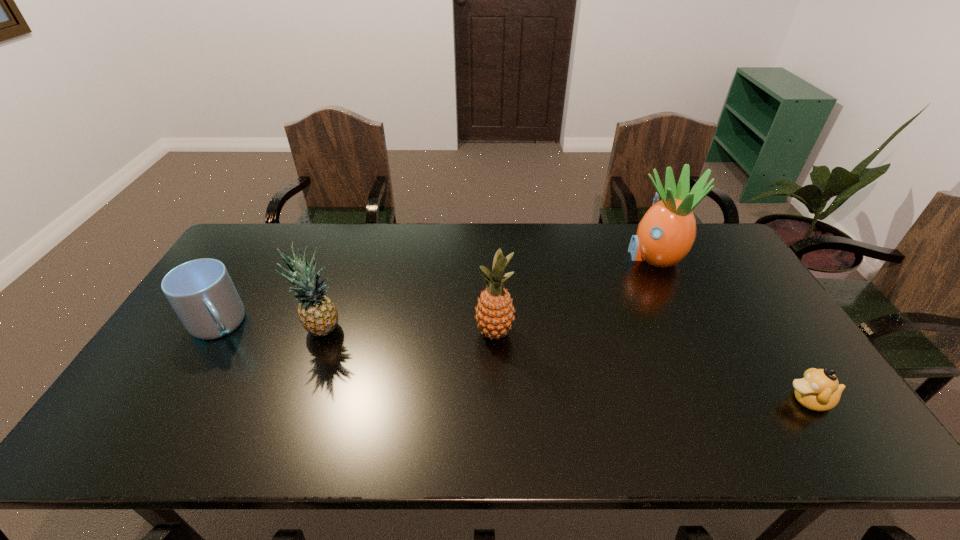
This screenshot has width=960, height=540. I want to click on vacant space at the far edge of the desktop, so click(x=309, y=241).

The height and width of the screenshot is (540, 960). I want to click on free space at the near edge, so click(x=405, y=427).

This screenshot has height=540, width=960. Identify the location of vacant space at the right edge of the desktop. (719, 274).

Where is `free spot at the far right corner of the desktop`? free spot at the far right corner of the desktop is located at coordinates (698, 239).

Locate an element on the screen. Image resolution: width=960 pixels, height=540 pixels. free space that is in between the mug and the second pineapple from right to left is located at coordinates (356, 329).

This screenshot has height=540, width=960. I want to click on vacant area that lies between the mug and the rightmost pineapple, so pos(437,290).

The height and width of the screenshot is (540, 960). Identify the location of vacant space that is in between the farthest pineapple and the third object from right to left. tap(574, 294).

Locate an element on the screen. free area in between the third object from left to right and the fourth object from left to right is located at coordinates (574, 294).

Image resolution: width=960 pixels, height=540 pixels. What are the coordinates of `free area in between the duckling and the rightmost pineapple` in the screenshot? It's located at (732, 328).

Locate an element on the screen. The width and height of the screenshot is (960, 540). vacant region between the fourth object from right to left and the nearest object is located at coordinates (565, 366).